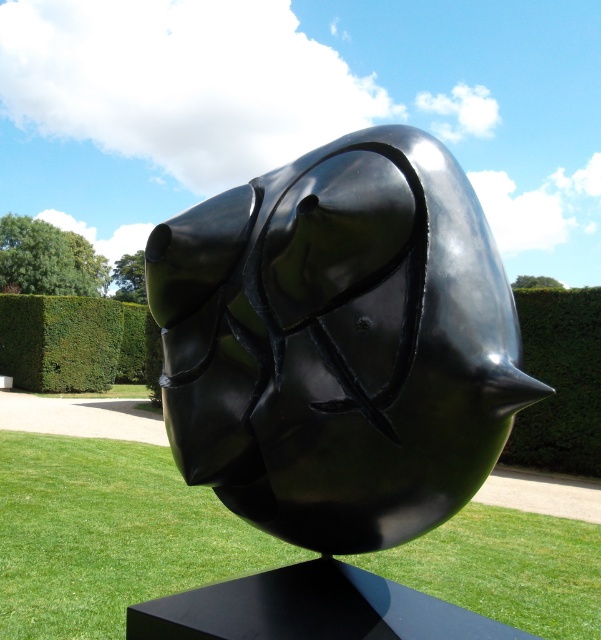
Who is positioned more to the right, glossy black sculpture at center or green leafy hedge at center?

From the viewer's perspective, glossy black sculpture at center appears more on the right side.

Which is more to the left, glossy black sculpture at center or green leafy hedge at center?

From the viewer's perspective, green leafy hedge at center appears more on the left side.

Which is behind, point (230, 481) or point (56, 388)?

The point (56, 388) is behind.

I want to click on glossy black sculpture at center, so click(338, 342).

Is green grass at center behind green leafy hedge at center?

No, green grass at center is closer to the viewer.

Can you confirm if green grass at center is thinner than green leafy hedge at center?

Incorrect, green grass at center's width is not less than green leafy hedge at center's.

The width and height of the screenshot is (601, 640). What are the coordinates of `green grass at center` in the screenshot? It's located at (108, 534).

Does green grass at center appear on the right side of green hedge at right?

No, green grass at center is not to the right of green hedge at right.

Is point (93, 541) farther from viewer compared to point (570, 342)?

No, (93, 541) is in front of (570, 342).

Locate an element on the screen. green grass at center is located at coordinates (108, 534).